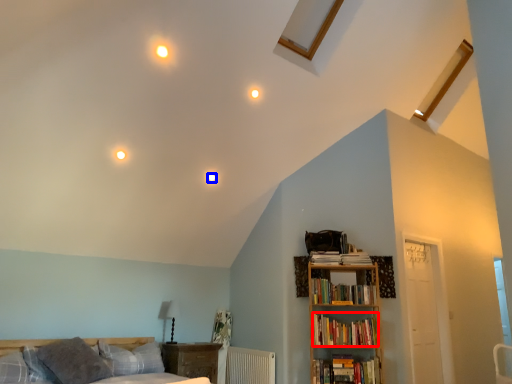
Question: Which object is closer to the camera taking this photo, book (highlighted by a red box) or lighting (highlighted by a blue box)?

Choices:
 (A) book
 (B) lighting

Answer: (A)